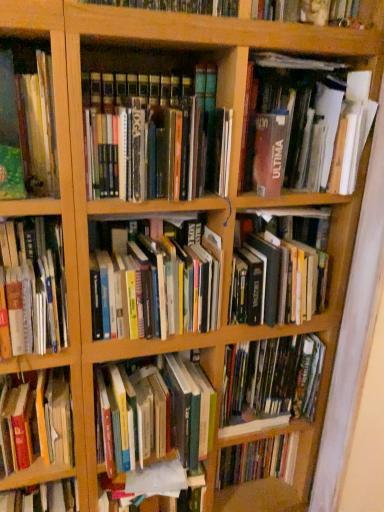
The image size is (384, 512). In order to click on hardcover book at center, which is the sixth book from bottom to top in this screenshot , I will do `click(278, 270)`.

The height and width of the screenshot is (512, 384). In order to click on hardcover book at left, the 9th book in the top-to-bottom sequence in this screenshot , I will do `click(37, 422)`.

This screenshot has height=512, width=384. I want to click on hardcover books at center, positioned as the 8th book in top-to-bottom order, so click(155, 414).

Where is `hardcover book at center, the 4th book positioned from the top`? hardcover book at center, the 4th book positioned from the top is located at coordinates (278, 270).

What's the angular difference between hardcover book at center, the 4th book positioned from the top, and hardcover books at center, the 5th book positioned from the top,'s facing directions?

The angle between the facing direction of hardcover book at center, the 4th book positioned from the top, and the facing direction of hardcover books at center, the 5th book positioned from the top, is 3.68 degrees.

Are hardcover book at center, which is the sixth book from bottom to top, and hardcover books at center, which is the 5th book from bottom to top, located far from each other?

No, hardcover book at center, which is the sixth book from bottom to top, is in close proximity to hardcover books at center, which is the 5th book from bottom to top.

Can you confirm if hardcover book at center, the 4th book positioned from the top, is smaller than hardcover books at center, which is the 5th book from bottom to top?

Actually, hardcover book at center, the 4th book positioned from the top, might be larger than hardcover books at center, which is the 5th book from bottom to top.

From the hardcover book at center, the 4th book positioned from the top, count 1st books forward and point to it. Please provide its 2D coordinates.

[(152, 284)]

Does hardcover book at left, the 1th book ordered from the bottom, have a greater width compared to hardcover books at center, positioned as the 7th book in bottom-to-top order?

No.

Which is in front, point (24, 468) or point (90, 113)?

The point (90, 113) is closer to the camera.

Which of these two, matte brown book at upper right, which is counted as the first book, starting from the top, or hardcover books at center, which is the 5th book from bottom to top, stands taller?

Standing taller between the two is matte brown book at upper right, which is counted as the first book, starting from the top.

What's the angular difference between matte brown book at upper right, the ninth book ordered from the bottom, and hardcover books at center, which is the 5th book from bottom to top,'s facing directions?

There is a 0.000535-degree angle between the facing directions of matte brown book at upper right, the ninth book ordered from the bottom, and hardcover books at center, which is the 5th book from bottom to top.

From the image's perspective, does matte brown book at upper right, which is counted as the first book, starting from the top, appear lower than hardcover books at center, the 5th book positioned from the top?

Incorrect, from the image's perspective, matte brown book at upper right, which is counted as the first book, starting from the top, is higher than hardcover books at center, the 5th book positioned from the top.

Consider the image. Relative to hardcover books at center, which is the 5th book from bottom to top, is matte brown book at upper right, the ninth book ordered from the bottom, in front or behind?

Clearly, matte brown book at upper right, the ninth book ordered from the bottom, is in front of hardcover books at center, which is the 5th book from bottom to top.

Is matte brown book at upper right, the ninth book ordered from the bottom, shorter than hardcover book at left, which is counted as the 4th book, starting from the bottom?

No.

Measure the distance from matte brown book at upper right, the ninth book ordered from the bottom, to hardcover book at left, which is counted as the 4th book, starting from the bottom.

A distance of 26.80 inches exists between matte brown book at upper right, the ninth book ordered from the bottom, and hardcover book at left, which is counted as the 4th book, starting from the bottom.

From a real-world perspective, is matte brown book at upper right, which is counted as the first book, starting from the top, physically above hardcover book at left, which appears as the 6th book when viewed from the top?

Yes.

Locate an element on the screen. the 7th book counting from the right side of the hardcover book at left, which appears as the 6th book when viewed from the top is located at coordinates 303,125.

How many degrees apart are the facing directions of hardcover books at center, which is the 2th book in bottom-to-top order, and hardcover book at left, the 9th book in the top-to-bottom sequence?

The angle between the facing direction of hardcover books at center, which is the 2th book in bottom-to-top order, and the facing direction of hardcover book at left, the 9th book in the top-to-bottom sequence, is 0.00118 degrees.

Which of these two, hardcover books at center, which is the 2th book in bottom-to-top order, or hardcover book at left, the 9th book in the top-to-bottom sequence, stands taller?

Standing taller between the two is hardcover books at center, which is the 2th book in bottom-to-top order.

Is hardcover books at center, positioned as the 8th book in top-to-bottom order, at the right side of hardcover book at left, the 1th book ordered from the bottom?

Correct, you'll find hardcover books at center, positioned as the 8th book in top-to-bottom order, to the right of hardcover book at left, the 1th book ordered from the bottom.

From a real-world perspective, is hardcover books at center, positioned as the 8th book in top-to-bottom order, below hardcover book at left, the 1th book ordered from the bottom?

Yes, from a real-world perspective, hardcover books at center, positioned as the 8th book in top-to-bottom order, is under hardcover book at left, the 1th book ordered from the bottom.

Would you say hardcover book at left, the 1th book ordered from the bottom, is outside hardcover book at center, which is the sixth book from bottom to top?

Yes, hardcover book at left, the 1th book ordered from the bottom, is not within hardcover book at center, which is the sixth book from bottom to top.

How many degrees apart are the facing directions of hardcover book at left, the 1th book ordered from the bottom, and hardcover book at center, the 4th book positioned from the top?

There is a 3.68-degree angle between the facing directions of hardcover book at left, the 1th book ordered from the bottom, and hardcover book at center, the 4th book positioned from the top.

What are the coordinates of `the 7th book to the left when counting from the hardcover book at center, the 4th book positioned from the top` in the screenshot? It's located at (37, 422).

Is hardcover books at center, which is the 5th book from bottom to top, in front of or behind matte brown book at upper right, which is counted as the first book, starting from the top, in the image?

In the image, hardcover books at center, which is the 5th book from bottom to top, appears behind matte brown book at upper right, which is counted as the first book, starting from the top.

From the picture: Is hardcover books at center, the 5th book positioned from the top, not inside matte brown book at upper right, the ninth book ordered from the bottom?

Yes, hardcover books at center, the 5th book positioned from the top, is located beyond the bounds of matte brown book at upper right, the ninth book ordered from the bottom.

Based on their sizes in the image, would you say hardcover books at center, which is the 5th book from bottom to top, is bigger or smaller than matte brown book at upper right, which is counted as the first book, starting from the top?

In the image, hardcover books at center, which is the 5th book from bottom to top, appears to be smaller than matte brown book at upper right, which is counted as the first book, starting from the top.

In the scene shown: Is hardcover books at center, which is the 5th book from bottom to top, with matte brown book at upper right, which is counted as the first book, starting from the top?

hardcover books at center, which is the 5th book from bottom to top, and matte brown book at upper right, which is counted as the first book, starting from the top, are clearly separated.

The width and height of the screenshot is (384, 512). There is a hardcover book at center, which is the sixth book from bottom to top. In order to click on the 1st book below it (from the image's perspective) in this screenshot , I will do `click(152, 284)`.

The height and width of the screenshot is (512, 384). I want to click on the 5th book to the right of the hardcover book at left, the 9th book in the top-to-bottom sequence, starting your count from the anchor, so click(x=158, y=141).

Looking at this image, based on their spatial positions, is hardcover book at center, which is the 7th book from top to bottom, or hardcover book at center, the 4th book positioned from the top, closer to hardcover book at left, which appears as the 6th book when viewed from the top?

Based on the image, hardcover book at center, the 4th book positioned from the top, appears to be nearer to hardcover book at left, which appears as the 6th book when viewed from the top.

Estimate the real-world distances between objects in this image. Which object is closer to hardcover books at center, the 5th book positioned from the top, hardcover book at center, which is the sixth book from bottom to top, or hardcover books at center, positioned as the 8th book in top-to-bottom order?

hardcover book at center, which is the sixth book from bottom to top, is closer to hardcover books at center, the 5th book positioned from the top.

Looking at the image, which one is located further to hardcover books at center, the 5th book positioned from the top, hardcover book at left, the 1th book ordered from the bottom, or hardcover books at center, which is the 2th book in bottom-to-top order?

Based on the image, hardcover book at left, the 1th book ordered from the bottom, appears to be further to hardcover books at center, the 5th book positioned from the top.

Estimate the real-world distances between objects in this image. Which object is closer to hardcover book at left, the 1th book ordered from the bottom, hardcover book at center, the 4th book positioned from the top, or hardcover book at left, which appears as the 6th book when viewed from the top?

hardcover book at left, which appears as the 6th book when viewed from the top, lies closer to hardcover book at left, the 1th book ordered from the bottom, than the other object.

Which object lies nearer to the anchor point hardcover books at center, which is the 2th book in bottom-to-top order, green matte book at left, the second book in the top-to-bottom sequence, or hardcover book at left, the 1th book ordered from the bottom?

hardcover book at left, the 1th book ordered from the bottom, lies closer to hardcover books at center, which is the 2th book in bottom-to-top order, than the other object.

When comparing their distances from hardcover books at center, positioned as the 8th book in top-to-bottom order, does hardcover book at left, the 9th book in the top-to-bottom sequence, or matte brown book at upper right, the ninth book ordered from the bottom, seem further?

matte brown book at upper right, the ninth book ordered from the bottom, is further to hardcover books at center, positioned as the 8th book in top-to-bottom order.

Based on their spatial positions, is hardcover books at center, positioned as the 7th book in bottom-to-top order, or hardcover book at left, which appears as the 6th book when viewed from the top, closer to hardcover book at center, the third book from the bottom?

Among the two, hardcover book at left, which appears as the 6th book when viewed from the top, is located nearer to hardcover book at center, the third book from the bottom.

From the image, which object appears to be nearer to matte brown book at upper right, which is counted as the first book, starting from the top, hardcover books at center, which is the 5th book from bottom to top, or hardcover books at center, positioned as the 8th book in top-to-bottom order?

hardcover books at center, which is the 5th book from bottom to top.